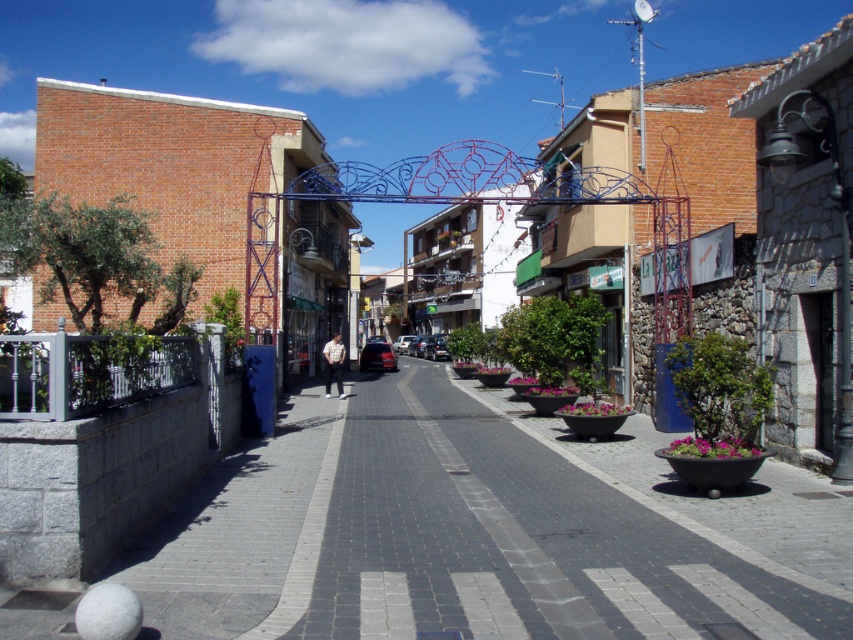
You are standing on the gray concrete pavement at center and looking up at the white cotton shirt at center. Which object is taller?

The white cotton shirt at center is taller than the gray concrete pavement at center.

You are a delivery person standing on the gray concrete pavement at center. You need to place a package on the white cotton shirt at center. Can you reach it without stepping off the pavement?

The gray concrete pavement at center might be wider than white cotton shirt at center, so there is a possibility that the package can be placed without stepping off, but the exact width difference is uncertain.

You are a pedestrian standing on the gray concrete pavement at center and want to reach the white cotton shirt at center. Which direction should you move to get there?

The gray concrete pavement at center is on the right side of the white cotton shirt at center, so you should move to the left to reach it.